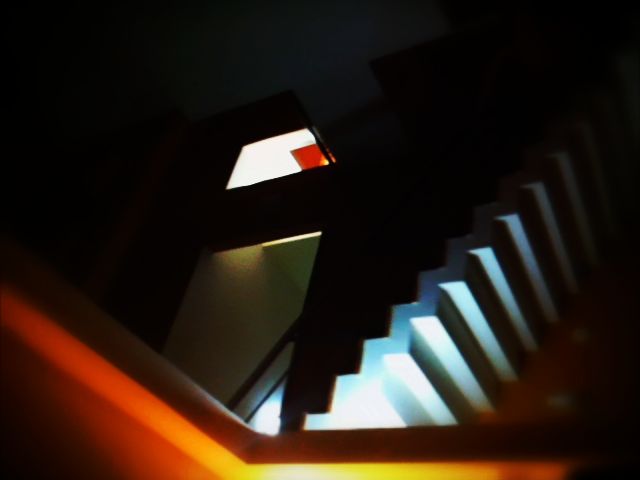
What are the coordinates of `horizontal white light` in the screenshot? It's located at (289, 239).